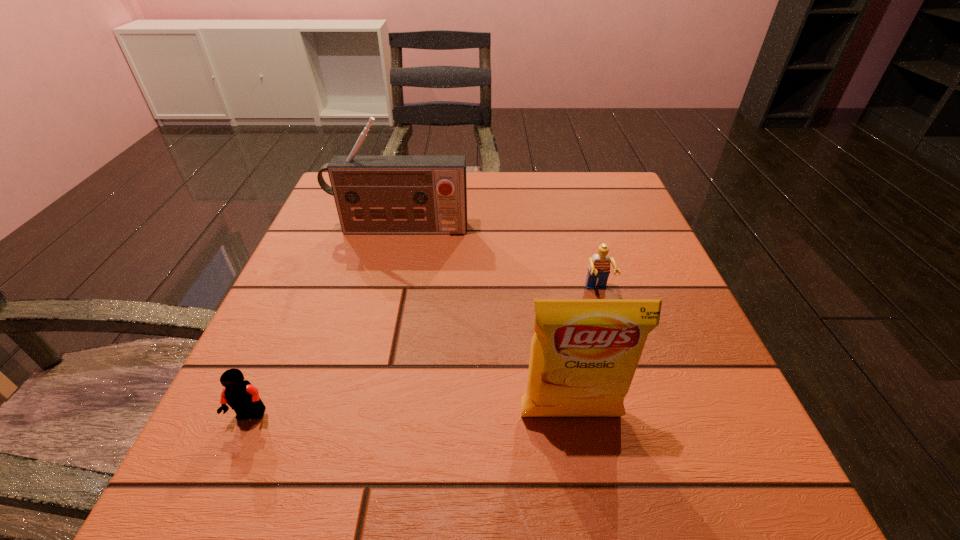
Image resolution: width=960 pixels, height=540 pixels. In order to click on vacant space at the near right corner of the desktop in this screenshot , I will do `click(732, 449)`.

Where is `vacant region between the left Lego and the right Lego`? This screenshot has height=540, width=960. vacant region between the left Lego and the right Lego is located at coordinates (424, 354).

You are a GUI agent. You are given a task and a screenshot of the screen. Output one action in this format:
    pyautogui.click(x=<x>, y=<y>)
    Task: Click on the vacant point located between the radio receiver and the crisp (potato chip)
    
    Given the screenshot: What is the action you would take?
    pyautogui.click(x=485, y=323)

Locate an element on the screen. This screenshot has height=540, width=960. free spot between the radio receiver and the left Lego is located at coordinates (325, 322).

Identify the location of vacant point located between the left Lego and the crisp (potato chip). [411, 416].

Image resolution: width=960 pixels, height=540 pixels. I want to click on vacant area that lies between the farthest object and the crisp (potato chip), so click(485, 323).

Identify the location of vacant space that's between the radio receiver and the crisp (potato chip). (485, 323).

Where is `free space between the nearer Lego and the crisp (potato chip)`? The image size is (960, 540). free space between the nearer Lego and the crisp (potato chip) is located at coordinates 411,416.

Identify the location of vacant area between the crisp (potato chip) and the radio receiver. This screenshot has height=540, width=960. (485, 323).

This screenshot has width=960, height=540. I want to click on vacant point located between the farther Lego and the nearer Lego, so click(x=424, y=354).